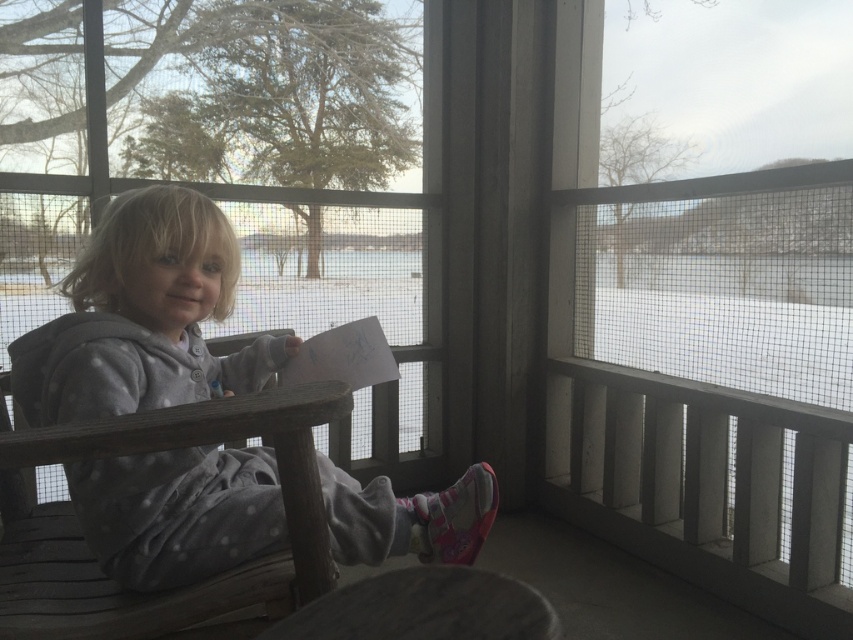
Question: Which object is positioned farthest from the transparent plastic window at center?

Choices:
 (A) gray fleece hoodie at center
 (B) wooden chair at center
 (C) white mesh screen door at center

Answer: (B)

Question: Is the position of transparent plastic window at center more distant than that of gray fleece hoodie at center?

Choices:
 (A) yes
 (B) no

Answer: (A)

Question: Which point is closer to the camera?

Choices:
 (A) (67, 618)
 (B) (177, 381)
 (C) (209, 72)

Answer: (A)

Question: Which is nearer to the transparent plastic window at center?

Choices:
 (A) white mesh screen door at center
 (B) wooden chair at center
 (C) gray fleece hoodie at center

Answer: (A)

Question: From the image, what is the correct spatial relationship of white mesh screen door at center in relation to wooden chair at center?

Choices:
 (A) left
 (B) right

Answer: (B)

Question: Does white mesh screen door at center have a greater width compared to transparent plastic window at center?

Choices:
 (A) yes
 (B) no

Answer: (B)